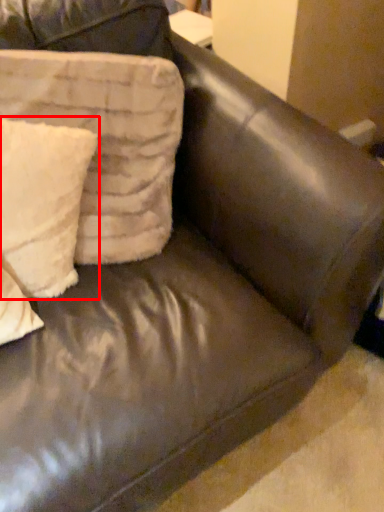
Question: From the image's perspective, what is the correct spatial positioning of pillow (annotated by the red box) in reference to pillow?

Choices:
 (A) below
 (B) above

Answer: (A)